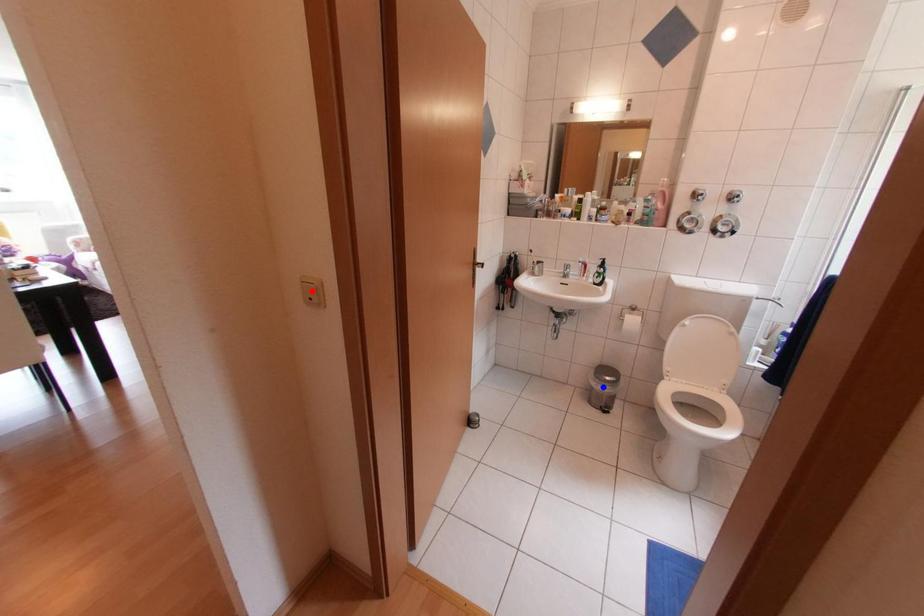
Question: Two points are marked on the image. Which point is closer to the camera?

Choices:
 (A) Blue point is closer.
 (B) Red point is closer.

Answer: (B)